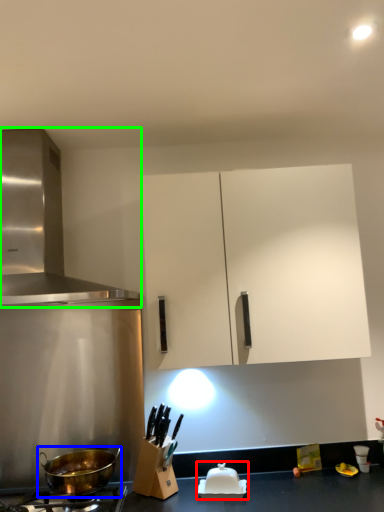
Question: Based on their relative distances, which object is farther from appliance (highlighted by a red box)? Choose from wok (highlighted by a blue box) and kitchen appliance (highlighted by a green box).

Choices:
 (A) wok
 (B) kitchen appliance

Answer: (B)